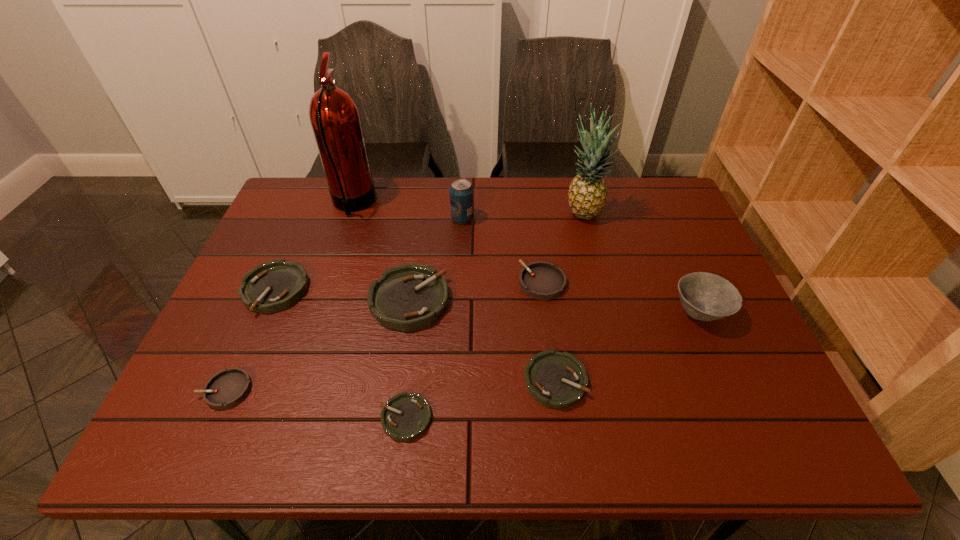
Where is `empty space between the bowl and the right gray ashtray`? The width and height of the screenshot is (960, 540). empty space between the bowl and the right gray ashtray is located at coordinates (621, 298).

Identify the location of empty location between the bigger gray ashtray and the biggest green ashtray. (476, 292).

The width and height of the screenshot is (960, 540). In order to click on free space that is in between the farther gray ashtray and the pineapple in this screenshot , I will do `click(563, 248)`.

Locate an element on the screen. empty space that is in between the right gray ashtray and the second smallest green ashtray is located at coordinates (549, 332).

Locate an element on the screen. The width and height of the screenshot is (960, 540). free space between the bowl and the tallest object is located at coordinates (526, 258).

At what (x,y) coordinates should I click in order to perform the action: click on vacant space in between the second biggest green ashtray and the eighth shortest object. Please return your answer as a coordinate pair (x, y). The height and width of the screenshot is (540, 960). Looking at the image, I should click on [369, 254].

In order to click on vacant area between the ninth object from left to right and the smallest green ashtray in this screenshot , I will do `click(494, 315)`.

The image size is (960, 540). Find the location of `object that is the sixth closest to the bowl`. object that is the sixth closest to the bowl is located at coordinates (406, 416).

At what (x,y) coordinates should I click in order to perform the action: click on object that is the fifth nearest to the smallest green ashtray. Please return your answer as a coordinate pair (x, y). Looking at the image, I should click on (540, 280).

This screenshot has width=960, height=540. I want to click on ashtray identified as the closest to the biggest green ashtray, so click(406, 416).